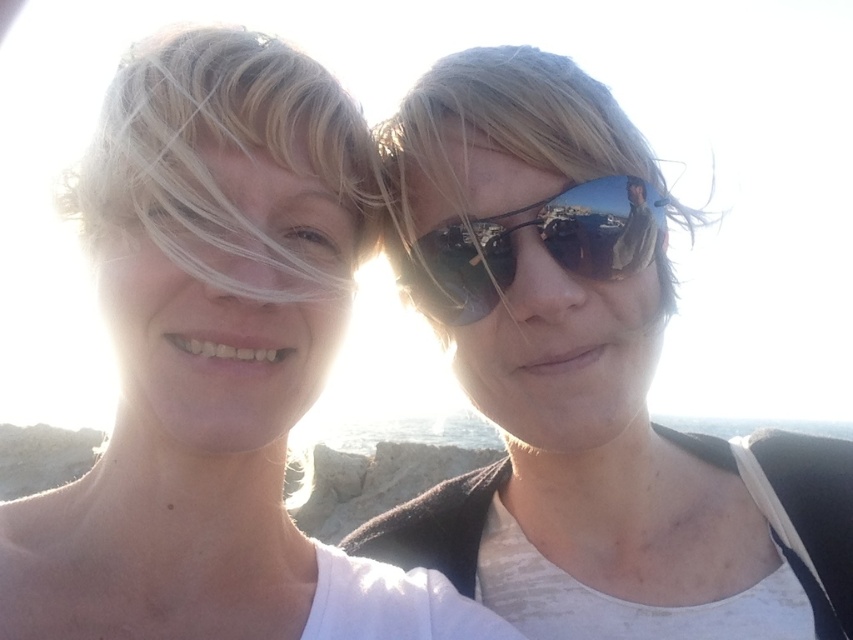
Question: Which of these objects is positioned farthest from the matte black sunglasses at center?

Choices:
 (A) blonde hair at upper right
 (B) matte white tank top at center

Answer: (B)

Question: Does matte black sunglasses at center appear over blonde hair at left?

Choices:
 (A) no
 (B) yes

Answer: (A)

Question: Among these objects, which one is nearest to the camera?

Choices:
 (A) sunglasses at right
 (B) matte white tank top at center
 (C) blonde hair at left

Answer: (B)

Question: Does matte black sunglasses at center appear on the right side of matte white tank top at center?

Choices:
 (A) yes
 (B) no

Answer: (A)

Question: Can you confirm if blonde hair at upper right is wider than sunglasses at right?

Choices:
 (A) no
 (B) yes

Answer: (B)

Question: Which point is farther from the camera taking this photo?

Choices:
 (A) (456, 204)
 (B) (688, 212)
 (C) (96, 161)
 (D) (572, 241)

Answer: (B)